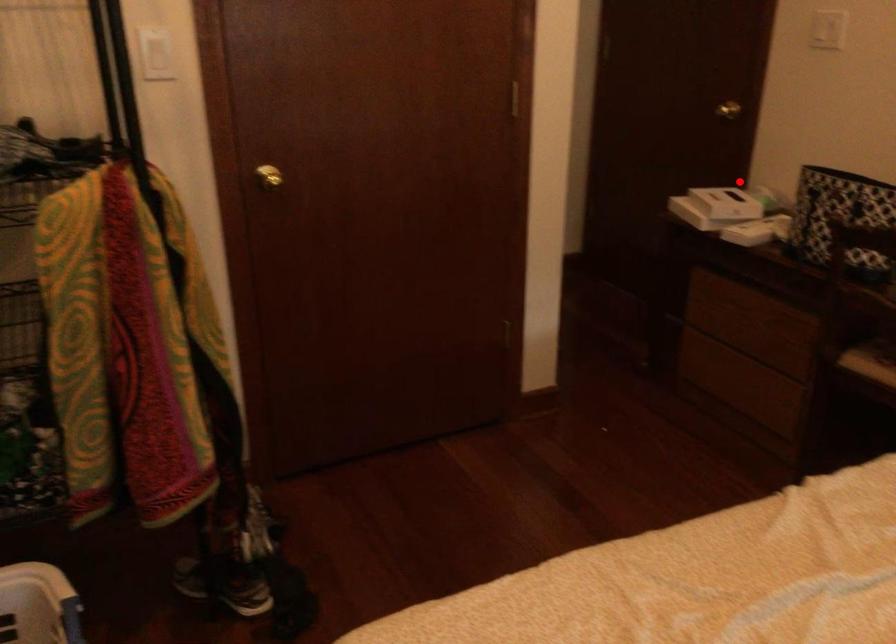
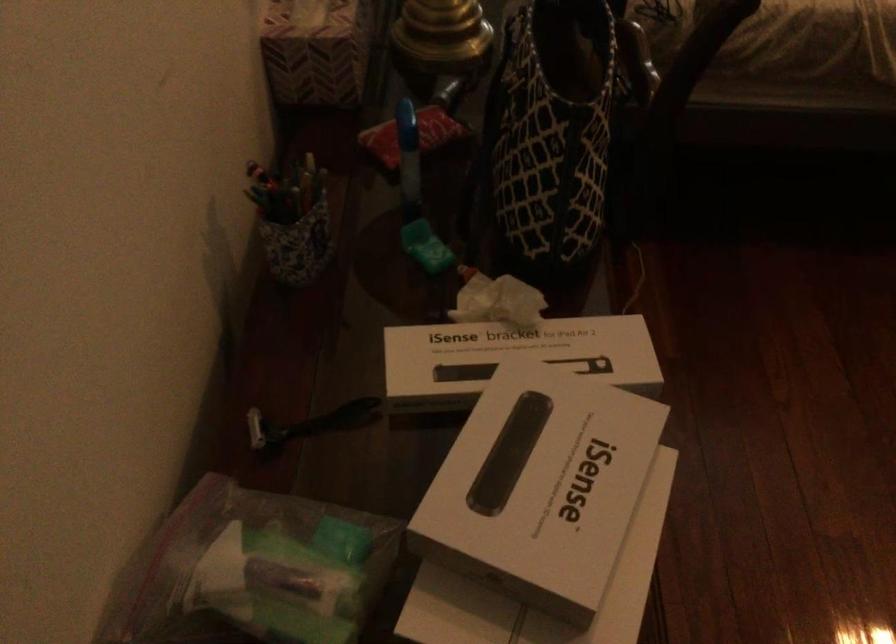
Question: A red point is marked in image1. In image2, is the corresponding 3D point closer to the camera or farther? Reply with the corresponding letter.

Choices:
 (A) The corresponding 3D point is closer.
 (B) The corresponding 3D point is farther.

Answer: (A)